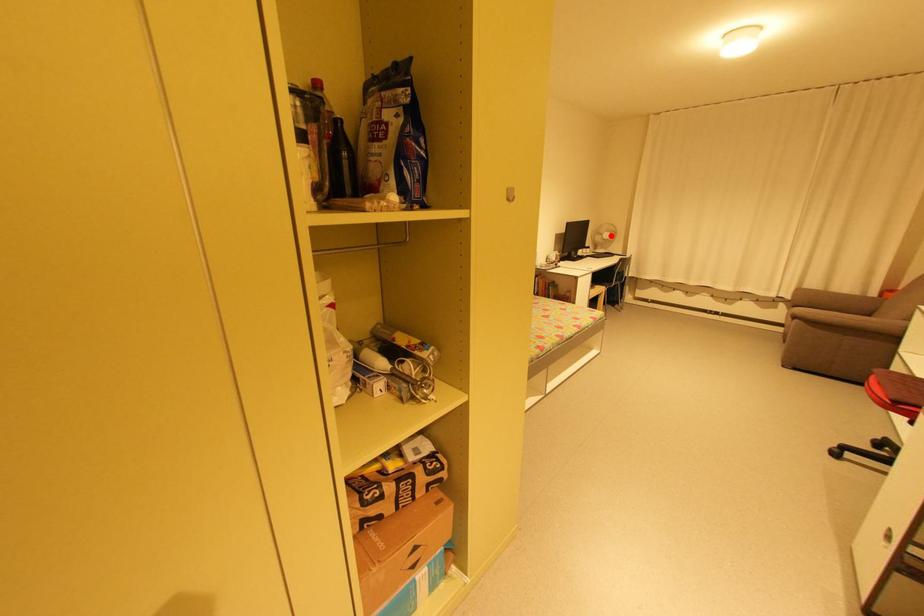
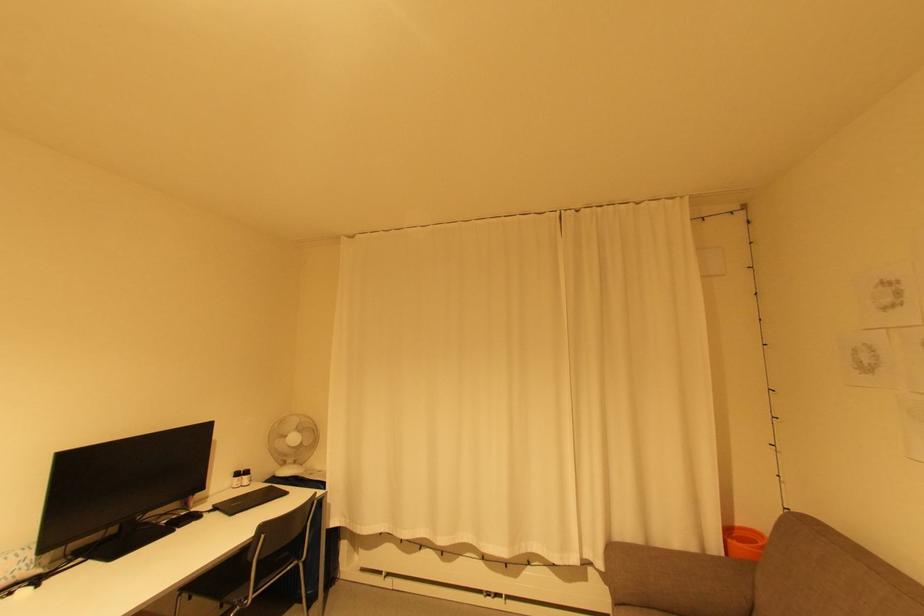
Question: A red point is marked in image1. In image2, is the corresponding 3D point closer to the camera or farther? Reply with the corresponding letter.

Choices:
 (A) The corresponding 3D point is closer.
 (B) The corresponding 3D point is farther.

Answer: (B)